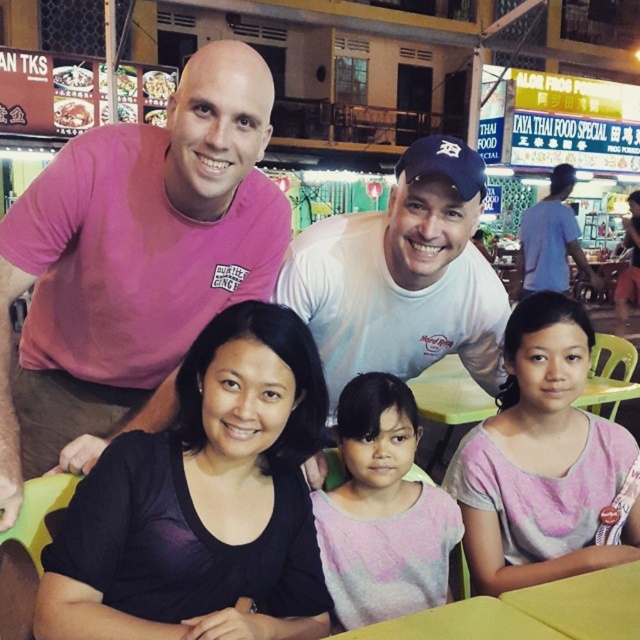
Does point (97, 285) lie in front of point (170, 97)?

Yes, point (97, 285) is in front of point (170, 97).

Is pink cotton shirt at upper left taller than white glossy noodles at upper left?

Yes.

Where is `pink cotton shirt at upper left`? pink cotton shirt at upper left is located at coordinates (132, 262).

Does pink cotton shirt at upper left have a greater height compared to black matte shirt at center?

Yes, pink cotton shirt at upper left is taller than black matte shirt at center.

Can you confirm if pink cotton shirt at upper left is wider than black matte shirt at center?

Yes.

This screenshot has width=640, height=640. I want to click on pink cotton shirt at upper left, so click(132, 262).

Which is above, blue cotton shirt at upper right or matte brown rice at upper left?

Positioned higher is matte brown rice at upper left.

Measure the distance between point (580, 253) and camera.

A distance of 9.05 meters exists between point (580, 253) and camera.

What are the coordinates of `blue cotton shirt at upper right` in the screenshot? It's located at (550, 241).